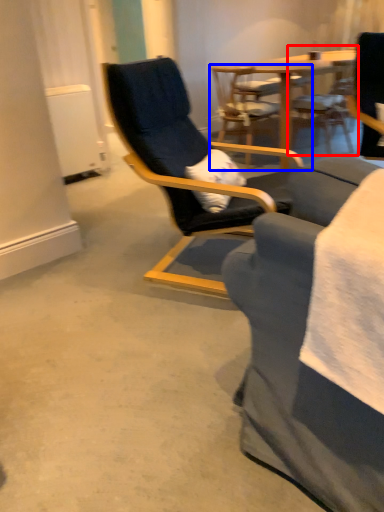
Question: Which point is closer to the camera, chair (highlighted by a red box) or chair (highlighted by a blue box)?

Choices:
 (A) chair
 (B) chair

Answer: (B)